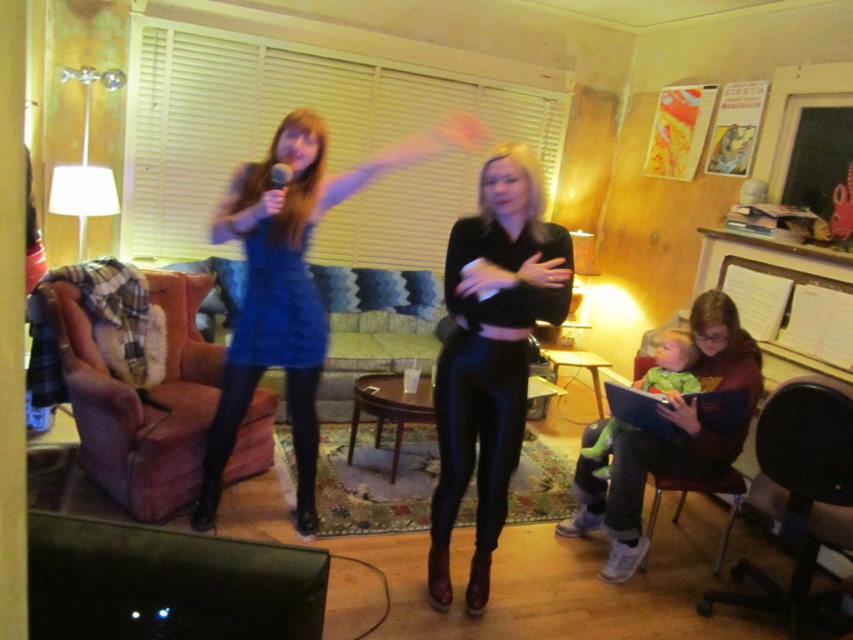
Who is positioned more to the right, blue shiny dress at center or green fabric armchair at lower right?

From the viewer's perspective, green fabric armchair at lower right appears more on the right side.

Does blue shiny dress at center appear over green fabric armchair at lower right?

Yes.

Is point (265, 225) farther from camera compared to point (637, 468)?

That is False.

The height and width of the screenshot is (640, 853). I want to click on blue shiny dress at center, so click(x=289, y=289).

Can you confirm if black leather armchair at lower right is wider than green fabric armchair at lower right?

In fact, black leather armchair at lower right might be narrower than green fabric armchair at lower right.

Can you confirm if black leather armchair at lower right is positioned above green fabric armchair at lower right?

No, black leather armchair at lower right is not above green fabric armchair at lower right.

This screenshot has height=640, width=853. Identify the location of black leather armchair at lower right. (798, 492).

You are a GUI agent. You are given a task and a screenshot of the screen. Output one action in this format:
    pyautogui.click(x=<x>, y=<y>)
    Task: Click on the black leather armchair at lower right
    
    Given the screenshot: What is the action you would take?
    pyautogui.click(x=798, y=492)

From the picture: Between shiny black pants at center and blue shiny dress at center, which one has less height?

shiny black pants at center

Is shiny black pants at center below blue shiny dress at center?

Correct, shiny black pants at center is located below blue shiny dress at center.

The height and width of the screenshot is (640, 853). In order to click on shiny black pants at center in this screenshot , I will do `click(490, 355)`.